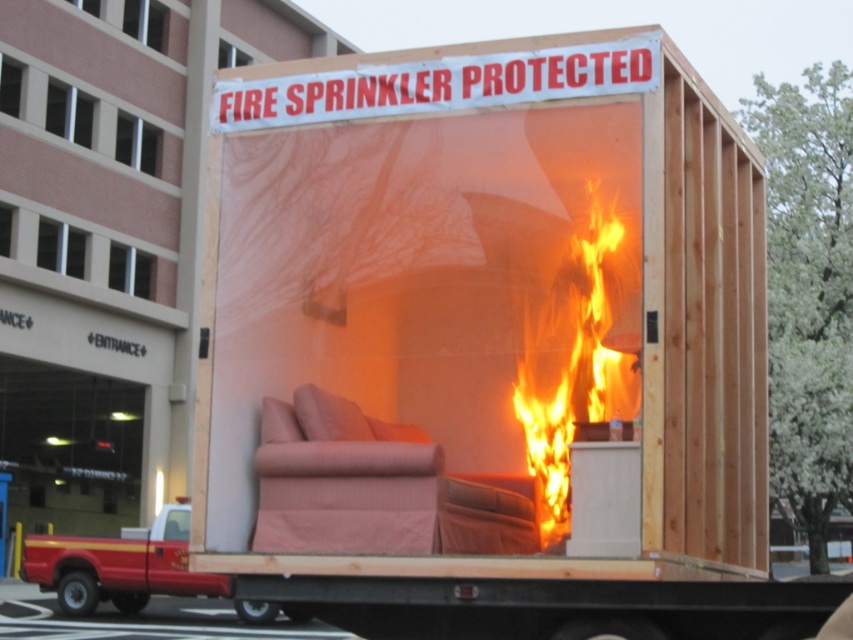
Between pink fabric couch at center and flaming orange fabric at center, which one appears on the right side from the viewer's perspective?

From the viewer's perspective, flaming orange fabric at center appears more on the right side.

Which is below, pink fabric couch at center or flaming orange fabric at center?

Positioned lower is pink fabric couch at center.

Locate an element on the screen. This screenshot has height=640, width=853. pink fabric couch at center is located at coordinates (343, 480).

The height and width of the screenshot is (640, 853). Identify the location of pink fabric couch at center. (343, 480).